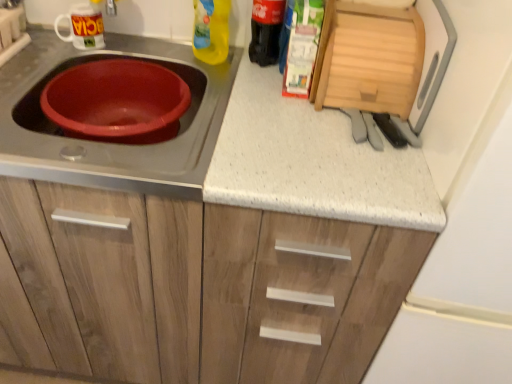
Where is `free point in front of black glass bottle at upper right, which appears as the 2th bottle when viewed from the left`? Image resolution: width=512 pixels, height=384 pixels. free point in front of black glass bottle at upper right, which appears as the 2th bottle when viewed from the left is located at coordinates (258, 91).